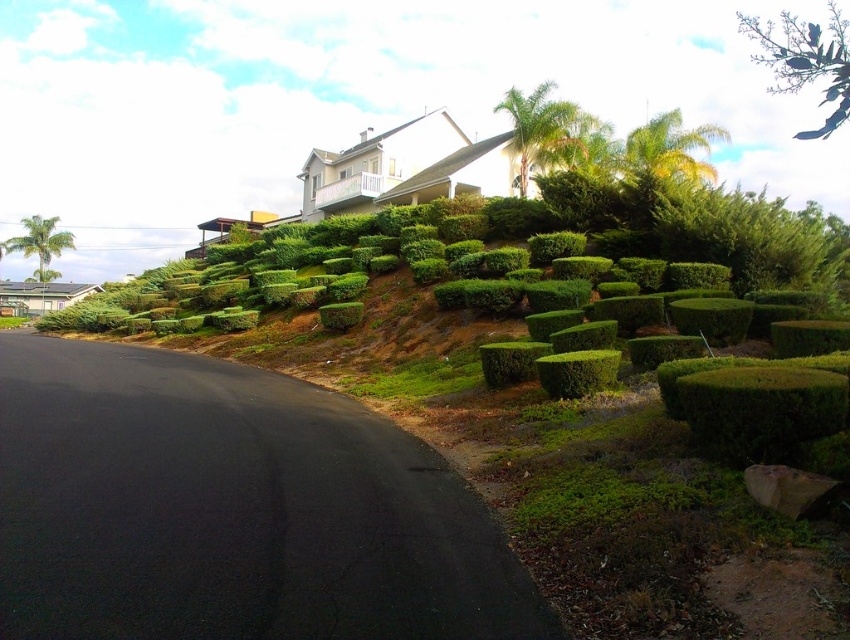
Is yellow-green leafy palm tree at upper right taller than green leafy palm tree at left?

Yes, yellow-green leafy palm tree at upper right is taller than green leafy palm tree at left.

Can you confirm if yellow-green leafy palm tree at upper right is shorter than green leafy palm tree at left?

In fact, yellow-green leafy palm tree at upper right may be taller than green leafy palm tree at left.

You are a GUI agent. You are given a task and a screenshot of the screen. Output one action in this format:
    pyautogui.click(x=<x>, y=<y>)
    Task: Click on the yellow-green leafy palm tree at upper right
    The image size is (850, 640).
    Given the screenshot: What is the action you would take?
    pyautogui.click(x=672, y=148)

You are a GUI agent. You are given a task and a screenshot of the screen. Output one action in this format:
    pyautogui.click(x=<x>, y=<y>)
    Task: Click on the yellow-green leafy palm tree at upper right
    
    Given the screenshot: What is the action you would take?
    pyautogui.click(x=672, y=148)

Who is positioned more to the right, yellow-green leafy palm tree at upper right or green leafy palm tree at upper right?

yellow-green leafy palm tree at upper right

Between yellow-green leafy palm tree at upper right and green leafy palm tree at upper right, which one is positioned higher?

green leafy palm tree at upper right is above.

Is point (627, 168) closer to viewer compared to point (552, 132)?

That is True.

Where is `yellow-green leafy palm tree at upper right`? The height and width of the screenshot is (640, 850). yellow-green leafy palm tree at upper right is located at coordinates (672, 148).

Is green leafy palm tree at upper right positioned in front of green leafy palm tree at left?

Yes, it is.

Is green leafy palm tree at upper right below green leafy palm tree at left?

Actually, green leafy palm tree at upper right is above green leafy palm tree at left.

At what (x,y) coordinates should I click in order to perform the action: click on green leafy palm tree at upper right. Please return your answer as a coordinate pair (x, y). Image resolution: width=850 pixels, height=640 pixels. Looking at the image, I should click on (537, 125).

Find the location of a particular element. This screenshot has height=640, width=850. green leafy palm tree at upper right is located at coordinates pyautogui.click(x=537, y=125).